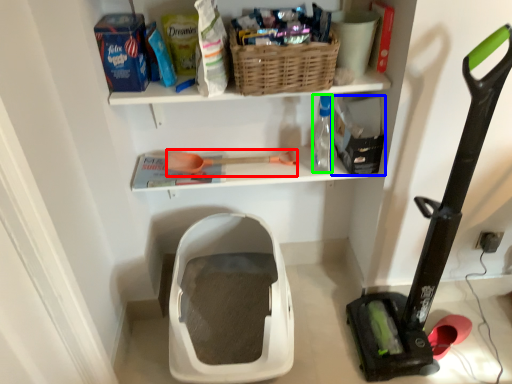
Question: Estimate the real-world distances between objects in this image. Which object is farther from tool (highlighted by a red box), storage box (highlighted by a blue box) or bottle (highlighted by a green box)?

Choices:
 (A) storage box
 (B) bottle

Answer: (A)